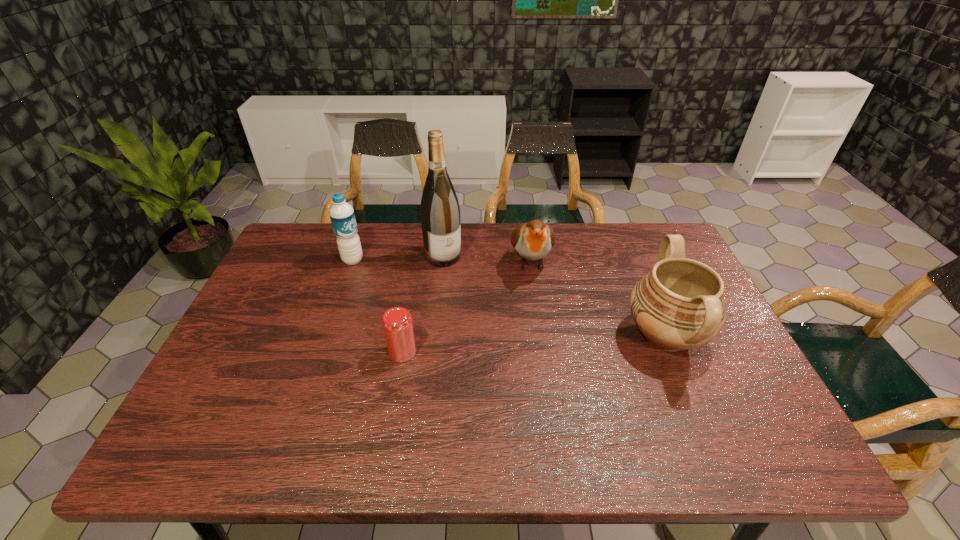
This screenshot has width=960, height=540. I want to click on the shortest object, so click(x=397, y=323).

This screenshot has width=960, height=540. Identify the location of the rightmost object. (679, 305).

Image resolution: width=960 pixels, height=540 pixels. I want to click on wine bottle, so click(440, 214).

Locate an element on the screen. The width and height of the screenshot is (960, 540). water bottle is located at coordinates (342, 216).

Where is `the second object from right to left`? This screenshot has height=540, width=960. the second object from right to left is located at coordinates (533, 240).

Identify the location of bird. The image size is (960, 540). pos(533,240).

Where is `free region located 0.220m on the right of the shortest object`? Image resolution: width=960 pixels, height=540 pixels. free region located 0.220m on the right of the shortest object is located at coordinates (503, 352).

Identify the location of vacant space situated on the front-facing side of the rightmost object. The image size is (960, 540). (470, 336).

At what (x,y) coordinates should I click in order to perform the action: click on vacant space located 0.340m on the front-facing side of the rightmost object. Please return your answer as a coordinate pair (x, y). Image resolution: width=960 pixels, height=540 pixels. Looking at the image, I should click on (493, 336).

Where is `vacant space located 0.090m on the front-facing side of the rightmost object`? The height and width of the screenshot is (540, 960). vacant space located 0.090m on the front-facing side of the rightmost object is located at coordinates coord(588,336).